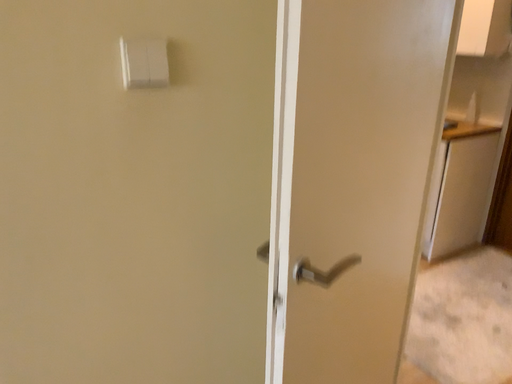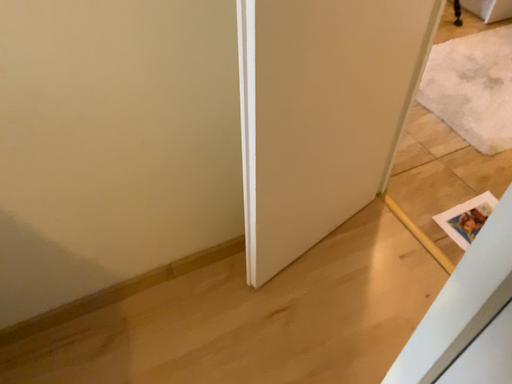
Question: Which way did the camera rotate in the video?

Choices:
 (A) rotated left
 (B) rotated right

Answer: (A)